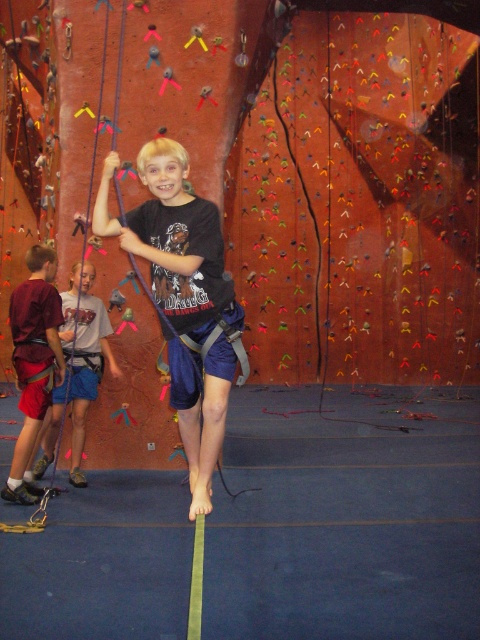
Question: Which point is farther to the camera?

Choices:
 (A) blue fabric shorts at center
 (B) matte blue shorts at center

Answer: (A)

Question: Which point is closer to the camera?

Choices:
 (A) [41, 410]
 (B) [133, 209]

Answer: (B)

Question: Is red cotton shorts at left to the right of blue fabric shorts at center from the viewer's perspective?

Choices:
 (A) no
 (B) yes

Answer: (A)

Question: Which object is the closest to the blue fabric shorts at center?

Choices:
 (A) red cotton shorts at left
 (B) matte blue shorts at center

Answer: (A)

Question: Is the position of matte blue shorts at center less distant than that of red cotton shorts at left?

Choices:
 (A) no
 (B) yes

Answer: (B)

Question: Is red cotton shorts at left positioned at the back of blue fabric shorts at center?

Choices:
 (A) no
 (B) yes

Answer: (A)